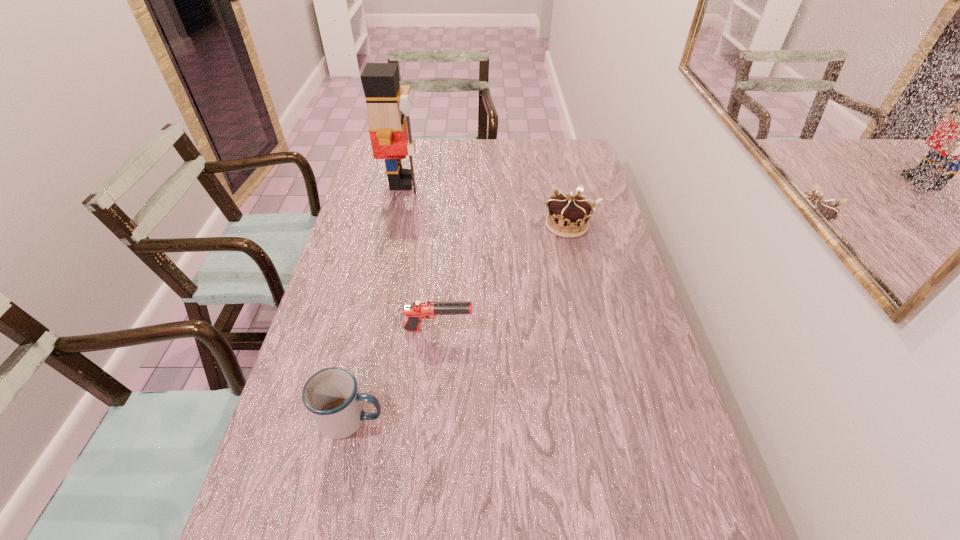
Identify the location of unoccupied position between the nearest object and the second object from right to left. point(396,375).

I want to click on vacant space in between the third farthest object and the farthest object, so click(420, 256).

The height and width of the screenshot is (540, 960). I want to click on vacant space that's between the nutcracker and the shortest object, so click(420, 256).

I want to click on vacant area between the second object from right to left and the rightmost object, so click(503, 278).

Identify the location of vacant region between the farthest object and the nearest object. (377, 301).

The height and width of the screenshot is (540, 960). Identify the location of free space between the third nearest object and the farthest object. (485, 204).

The height and width of the screenshot is (540, 960). Find the location of `free spot between the second nearest object and the crown`. free spot between the second nearest object and the crown is located at coordinates (503, 278).

This screenshot has height=540, width=960. Find the location of `unoccupied position between the nutcracker and the second farthest object`. unoccupied position between the nutcracker and the second farthest object is located at coordinates (485, 204).

You are a GUI agent. You are given a task and a screenshot of the screen. Output one action in this format:
    pyautogui.click(x=<x>, y=<y>)
    Task: Click on the unoccupied position between the third nearest object and the tallest object
    The image size is (960, 540).
    Given the screenshot: What is the action you would take?
    pyautogui.click(x=485, y=204)

Identify the location of unoccupied position between the mug and the tallest object. The image size is (960, 540). (377, 301).